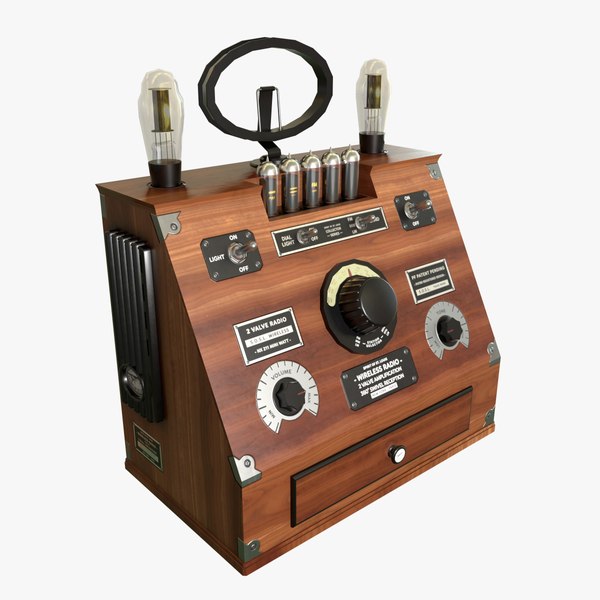
In order to click on space below radio in this screenshot , I will do `click(351, 558)`.